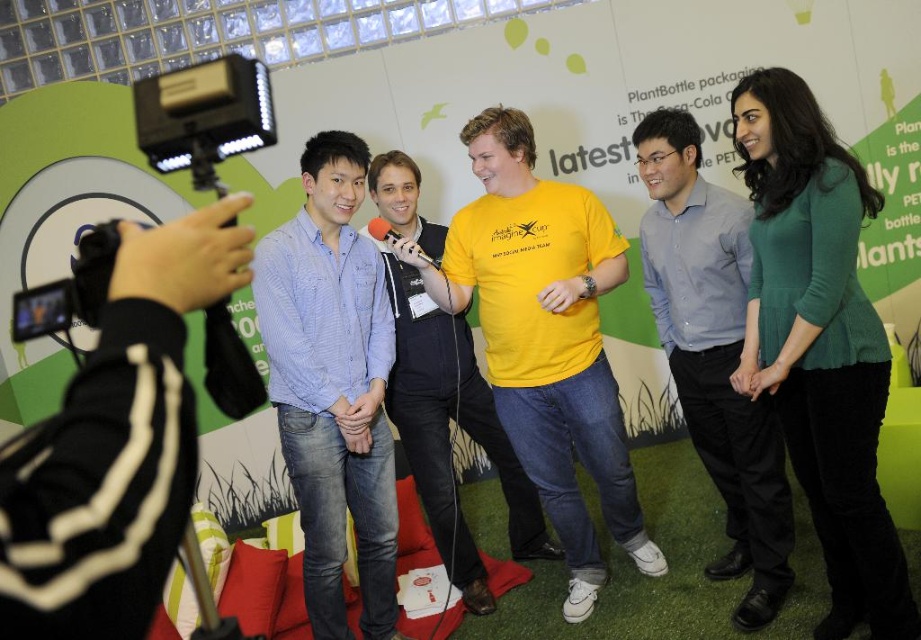
Is green matte sweater at center to the left of metallic silver microphone at center from the viewer's perspective?

In fact, green matte sweater at center is to the right of metallic silver microphone at center.

Does point (790, 232) come in front of point (383, 237)?

Yes, it is.

At what (x,y) coordinates should I click in order to perform the action: click on green matte sweater at center. Please return your answer as a coordinate pair (x, y). Looking at the image, I should click on (819, 342).

Between point (762, 289) and point (438, 330), which one is positioned behind?

Positioned behind is point (438, 330).

Is point (843, 182) behind point (511, 481)?

No, (843, 182) is in front of (511, 481).

The height and width of the screenshot is (640, 921). Identify the location of green matte sweater at center. [x=819, y=342].

Between green matte sweater at center and blue denim jeans at center, which one has more height?

blue denim jeans at center

Is green matte sweater at center shorter than blue denim jeans at center?

Yes.

Image resolution: width=921 pixels, height=640 pixels. Find the location of `green matte sweater at center`. green matte sweater at center is located at coordinates (819, 342).